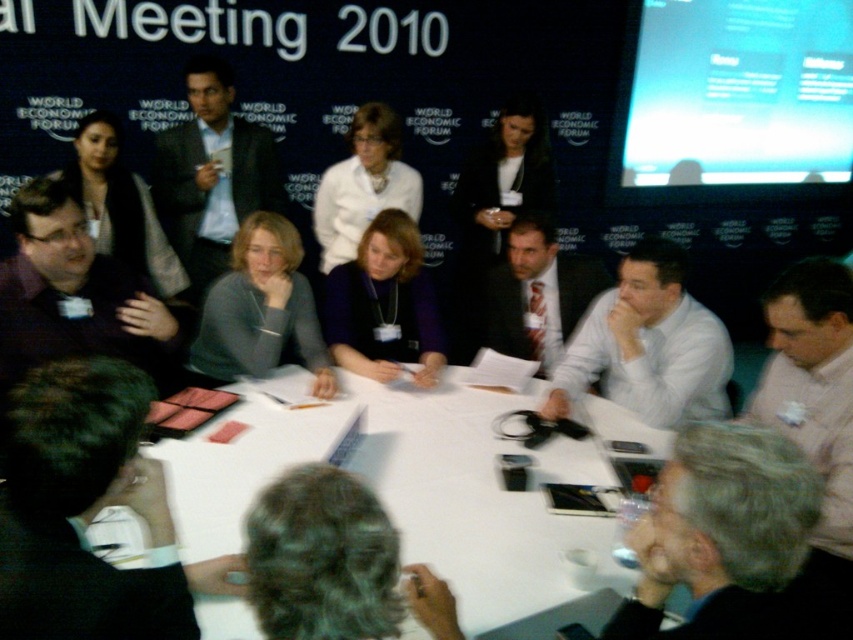
Question: Can you confirm if white paper at center is positioned to the left of white shirt at center?

Choices:
 (A) no
 (B) yes

Answer: (B)

Question: Can you confirm if green curly hair at lower center is positioned to the right of white shirt at center?

Choices:
 (A) no
 (B) yes

Answer: (A)

Question: Does green curly hair at lower center lie in front of white shirt at center?

Choices:
 (A) no
 (B) yes

Answer: (B)

Question: Among these objects, which one is farthest from the camera?

Choices:
 (A) white matte jacket at center
 (B) green curly hair at lower center
 (C) purple matte jacket at center

Answer: (A)

Question: Among these objects, which one is nearest to the camera?

Choices:
 (A) white shirt at center
 (B) purple matte jacket at center

Answer: (A)

Question: Which point is farther to the camera?

Choices:
 (A) (334, 292)
 (B) (144, 228)

Answer: (B)